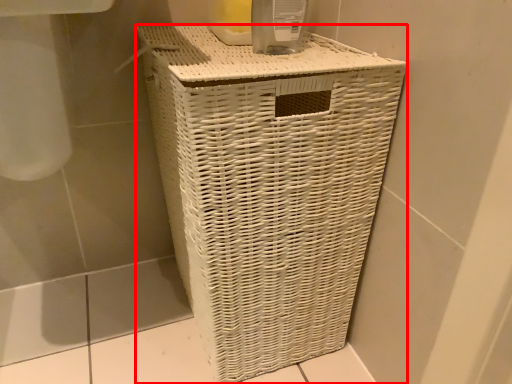
Question: From the image, what is the correct spatial relationship of waste container (annotated by the red box) in relation to glass jar?

Choices:
 (A) left
 (B) right

Answer: (A)